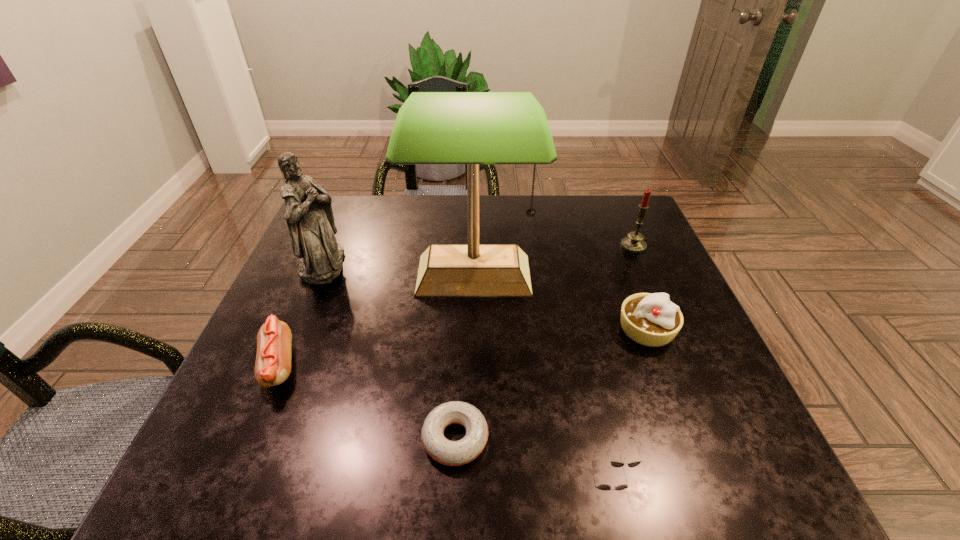
Locate an element on the screen. This screenshot has height=540, width=960. free point that satisfies the following two spatial constraints: 1. on the front-facing side of the second tallest object; 2. on the back side of the fourth shortest object is located at coordinates (296, 329).